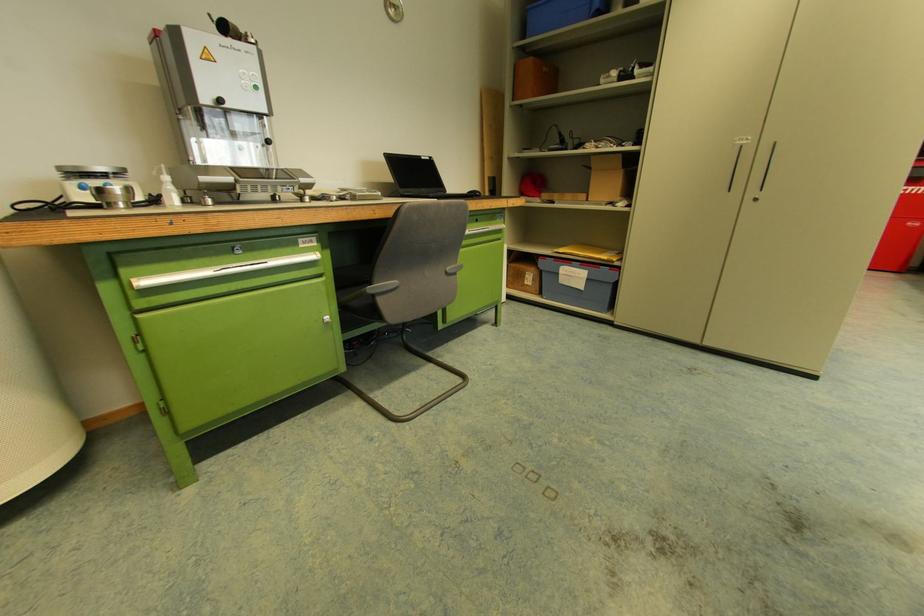
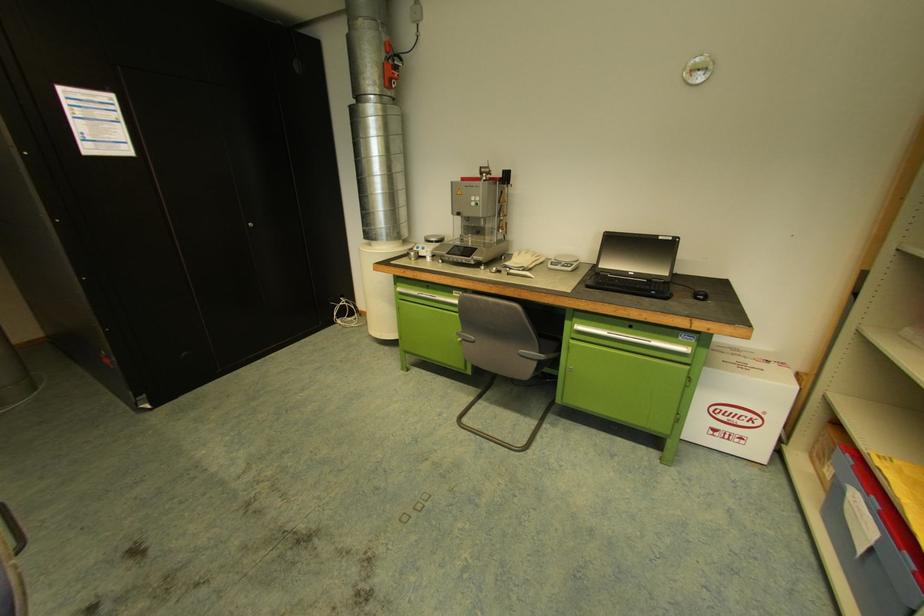
Where in the second image is the point corresponding to point (213, 201) from the first image?

(444, 261)